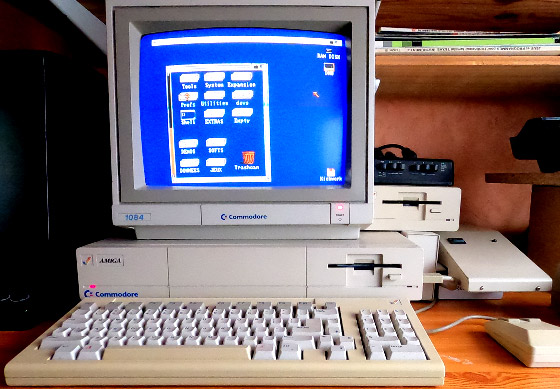
You are a GUI agent. You are given a task and a screenshot of the screen. Output one action in this format:
    pyautogui.click(x=<x>, y=<y>)
    Task: Click on the cord
    
    Given the screenshot: What is the action you would take?
    pyautogui.click(x=469, y=315)